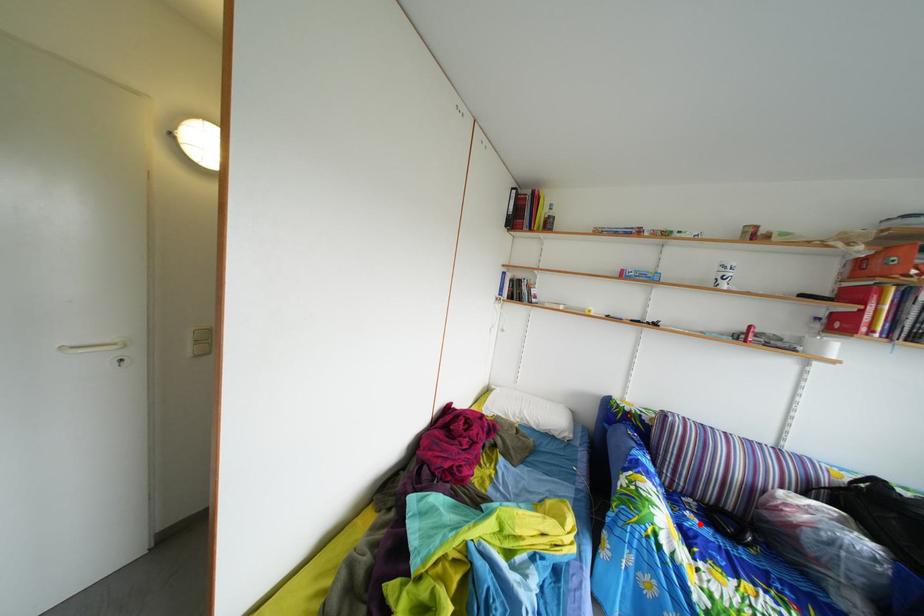
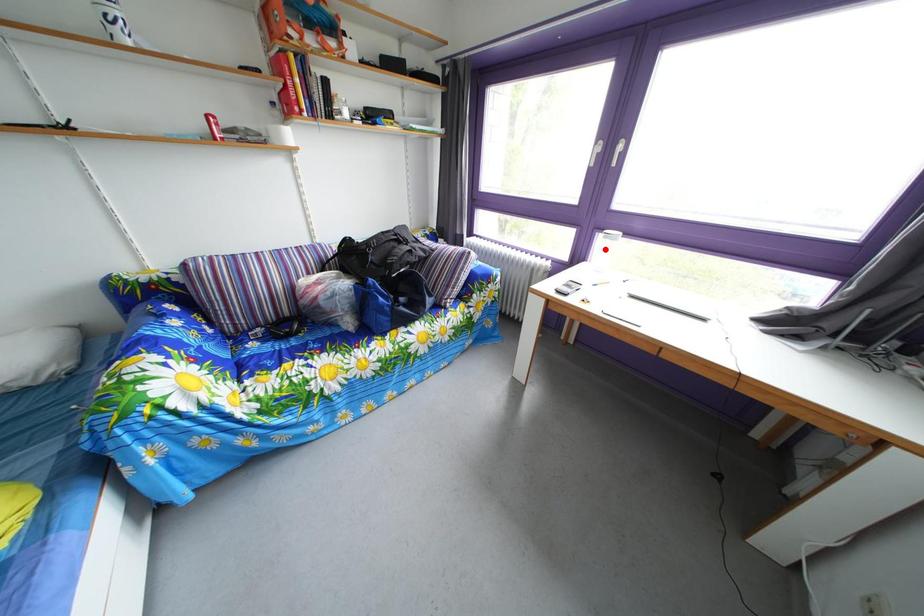
I am providing you with two images of the same scene from different viewpoints. A red point is marked on the first image and another point is marked on the second image. Do the highlighted points in image1 and image2 indicate the same real-world spot?

No